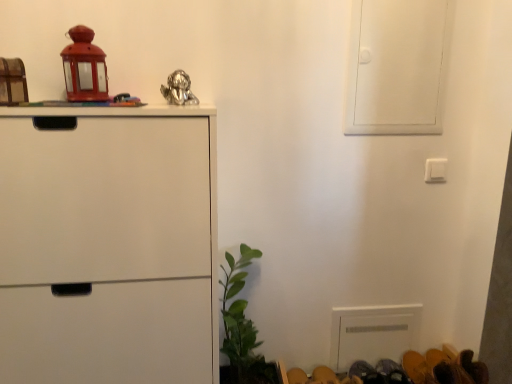
Describe the element at coordinates (84, 67) in the screenshot. The height and width of the screenshot is (384, 512). I see `matte red lantern at upper left, which is the 2th toy from left to right` at that location.

What do you see at coordinates (241, 327) in the screenshot? I see `green leafy plant at lower center` at bounding box center [241, 327].

Looking at this image, measure the distance between wooden block at left, the third toy positioned from the right, and camera.

wooden block at left, the third toy positioned from the right, is 3.39 feet from camera.

You are a GUI agent. You are given a task and a screenshot of the screen. Output one action in this format:
    pyautogui.click(x=<x>, y=<y>)
    Task: Click on the white matte screen door at upper right
    Image resolution: width=512 pixels, height=384 pixels.
    Given the screenshot: What is the action you would take?
    pyautogui.click(x=396, y=66)

The width and height of the screenshot is (512, 384). In order to click on matte red lantern at upper left, which is the 2th toy from left to right in this screenshot , I will do `click(84, 67)`.

Locate an element on the screen. Image resolution: width=512 pixels, height=384 pixels. light switch above the brown leather shoes at lower right (from the image's perspective) is located at coordinates (435, 170).

How different are the orientations of brown leather shoes at lower right and white plastic light switch at upper right in degrees?

There is a 0.359-degree angle between the facing directions of brown leather shoes at lower right and white plastic light switch at upper right.

Can you see brown leather shoes at lower right touching white plastic light switch at upper right?

No, brown leather shoes at lower right is not making contact with white plastic light switch at upper right.

Is brown leather shoes at lower right at the right side of white plastic light switch at upper right?

Incorrect, brown leather shoes at lower right is not on the right side of white plastic light switch at upper right.

In the scene shown: Does green leafy plant at lower center contain white plastic light switch at upper right?

That's incorrect, white plastic light switch at upper right is not inside green leafy plant at lower center.

From their relative heights in the image, would you say green leafy plant at lower center is taller or shorter than white plastic light switch at upper right?

In the image, green leafy plant at lower center appears to be taller than white plastic light switch at upper right.

Could you tell me if green leafy plant at lower center is facing white plastic light switch at upper right?

No, green leafy plant at lower center is not oriented towards white plastic light switch at upper right.

Does point (253, 380) lie behind point (437, 179)?

That is True.

Is white matte screen door at upper right inside the boundaries of wooden block at left, the third toy positioned from the right, or outside?

white matte screen door at upper right is spatially situated outside wooden block at left, the third toy positioned from the right.

From the image's perspective, which one is positioned lower, white matte screen door at upper right or wooden block at left, the first toy positioned from the left?

wooden block at left, the first toy positioned from the left, from the image's perspective.

Is point (375, 103) less distant than point (4, 98)?

No, it is behind (4, 98).

Is white matte screen door at upper right aimed at wooden block at left, the third toy positioned from the right?

No, white matte screen door at upper right is not aimed at wooden block at left, the third toy positioned from the right.

Considering the points (420, 380) and (435, 41), which point is behind, point (420, 380) or point (435, 41)?

The point (420, 380) is behind.

Based on the photo, is brown leather shoes at lower right taller than white matte screen door at upper right?

No, brown leather shoes at lower right is not taller than white matte screen door at upper right.

Is brown leather shoes at lower right facing towards white matte screen door at upper right?

No, brown leather shoes at lower right is not oriented towards white matte screen door at upper right.

From the image's perspective, would you say brown leather shoes at lower right is shown under white matte screen door at upper right?

Yes, from the image's perspective, brown leather shoes at lower right is below white matte screen door at upper right.

From a real-world perspective, which is physically below, shiny metallic figurine at upper center, which is the 1th toy in right-to-left order, or white matte screen door at upper right?

From a 3D spatial view, shiny metallic figurine at upper center, which is the 1th toy in right-to-left order, is below.

Is shiny metallic figurine at upper center, which is the 1th toy in right-to-left order, not within white matte screen door at upper right?

Yes, shiny metallic figurine at upper center, which is the 1th toy in right-to-left order, is located beyond the bounds of white matte screen door at upper right.

Looking at this image, considering the relative positions of shiny metallic figurine at upper center, which is the 3th toy from left to right, and white matte screen door at upper right in the image provided, is shiny metallic figurine at upper center, which is the 3th toy from left to right, to the left of white matte screen door at upper right from the viewer's perspective?

Indeed, shiny metallic figurine at upper center, which is the 3th toy from left to right, is positioned on the left side of white matte screen door at upper right.

From the image's perspective, who appears lower, shiny metallic figurine at upper center, which is the 3th toy from left to right, or white matte screen door at upper right?

shiny metallic figurine at upper center, which is the 3th toy from left to right, is shown below in the image.

Based on the photo, considering the sizes of objects green leafy plant at lower center and wooden block at left, the third toy positioned from the right, in the image provided, who is thinner, green leafy plant at lower center or wooden block at left, the third toy positioned from the right,?

wooden block at left, the third toy positioned from the right, is thinner.

Based on the photo, can you confirm if green leafy plant at lower center is positioned to the left of wooden block at left, the third toy positioned from the right?

No.

Locate an element on the screen. light switch above the brown leather shoes at lower right (from a real-world perspective) is located at coordinates (435, 170).

Who is smaller, white plastic light switch at upper right or brown leather shoes at lower right?

white plastic light switch at upper right.

Based on the photo, which is more to the left, white plastic light switch at upper right or brown leather shoes at lower right?

From the viewer's perspective, brown leather shoes at lower right appears more on the left side.

Is white plastic light switch at upper right next to brown leather shoes at lower right and touching it?

They are not placed beside each other.

At what (x,y) coordinates should I click in order to perform the action: click on furniture located underneath the white plastic light switch at upper right (from a real-world perspective). Please return your answer as a coordinate pair (x, y). This screenshot has width=512, height=384. Looking at the image, I should click on (444, 367).

The width and height of the screenshot is (512, 384). I want to click on light switch lying above the green leafy plant at lower center (from the image's perspective), so click(435, 170).

Based on their spatial positions, is white matte cabinet at left or white matte screen door at upper right further from wooden block at left, the first toy positioned from the left?

white matte screen door at upper right.

Looking at the image, which one is located closer to wooden block at left, the third toy positioned from the right, brown leather shoes at lower right or shiny metallic figurine at upper center, which is the 1th toy in right-to-left order?

shiny metallic figurine at upper center, which is the 1th toy in right-to-left order, lies closer to wooden block at left, the third toy positioned from the right, than the other object.

Considering their positions, is wooden block at left, the first toy positioned from the left, positioned further to white plastic light switch at upper right than green leafy plant at lower center?

wooden block at left, the first toy positioned from the left.

When comparing their distances from brown leather shoes at lower right, does white matte screen door at upper right or white plastic light switch at upper right seem further?

white matte screen door at upper right is positioned further to the anchor brown leather shoes at lower right.

Looking at the image, which one is located further to shiny metallic figurine at upper center, which is the 1th toy in right-to-left order, matte red lantern at upper left, which is the 2th toy from left to right, or white matte screen door at upper right?

Based on the image, white matte screen door at upper right appears to be further to shiny metallic figurine at upper center, which is the 1th toy in right-to-left order.

Looking at the image, which one is located further to shiny metallic figurine at upper center, which is the 3th toy from left to right, white matte screen door at upper right or white matte cabinet at left?

white matte screen door at upper right is positioned further to the anchor shiny metallic figurine at upper center, which is the 3th toy from left to right.

Which object lies nearer to the anchor point white matte cabinet at left, wooden block at left, the third toy positioned from the right, or white matte screen door at upper right?

wooden block at left, the third toy positioned from the right, is positioned closer to the anchor white matte cabinet at left.

Estimate the real-world distances between objects in this image. Which object is further from green leafy plant at lower center, brown leather shoes at lower right or matte red lantern at upper left, marked as the second toy in a right-to-left arrangement?

matte red lantern at upper left, marked as the second toy in a right-to-left arrangement, is positioned further to the anchor green leafy plant at lower center.

Locate an element on the screen. chest of drawers between shiny metallic figurine at upper center, which is the 1th toy in right-to-left order, and brown leather shoes at lower right from top to bottom is located at coordinates (106, 244).

Find the location of `toy between matte red lantern at upper left, which is the 2th toy from left to right, and white matte screen door at upper right`. toy between matte red lantern at upper left, which is the 2th toy from left to right, and white matte screen door at upper right is located at coordinates (179, 89).

At what (x,y) coordinates should I click in order to perform the action: click on plant between wooden block at left, the third toy positioned from the right, and white plastic light switch at upper right. Please return your answer as a coordinate pair (x, y). Looking at the image, I should click on (241, 327).

The width and height of the screenshot is (512, 384). I want to click on plant between matte red lantern at upper left, which is the 2th toy from left to right, and brown leather shoes at lower right, in the vertical direction, so click(x=241, y=327).